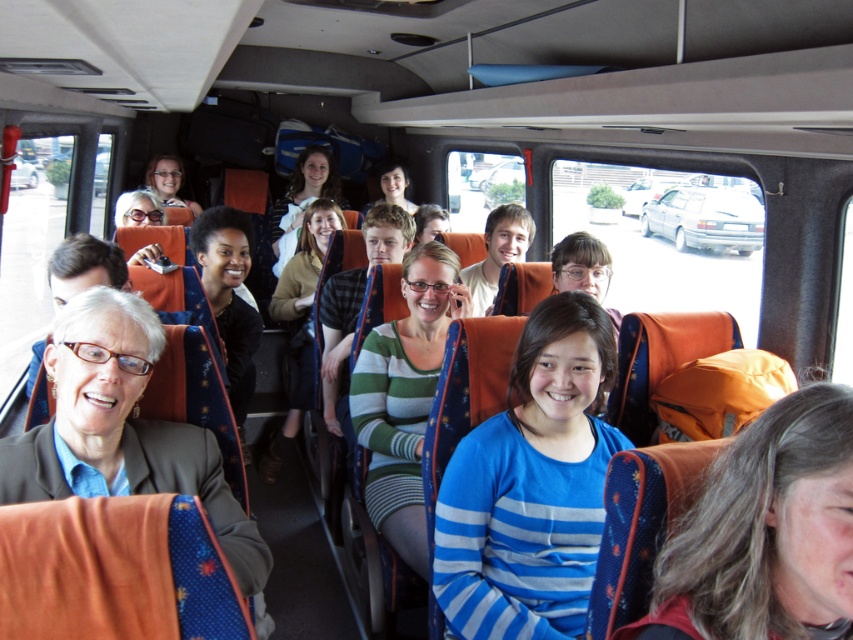
Question: Does matte brown jacket at lower left appear on the right side of light brown hair at center?

Choices:
 (A) no
 (B) yes

Answer: (A)

Question: Which is nearer to the matte green sweater at center?

Choices:
 (A) gray hair at right
 (B) light brown hair at center

Answer: (B)

Question: Considering the relative positions of matte brown jacket at lower left and light brown hair at center in the image provided, where is matte brown jacket at lower left located with respect to light brown hair at center?

Choices:
 (A) right
 (B) left

Answer: (B)

Question: Which of the following is the closest to the observer?

Choices:
 (A) blue striped shirt at center
 (B) gray hair at right
 (C) light brown hair at center
 (D) matte green sweater at center

Answer: (B)

Question: Which object is closer to the camera taking this photo?

Choices:
 (A) green and white striped sweater at center
 (B) gray hair at right
 (C) light brown hair at center
 (D) blue striped shirt at center

Answer: (B)

Question: Does matte black glasses at center have a larger size compared to matte green sweater at center?

Choices:
 (A) no
 (B) yes

Answer: (A)